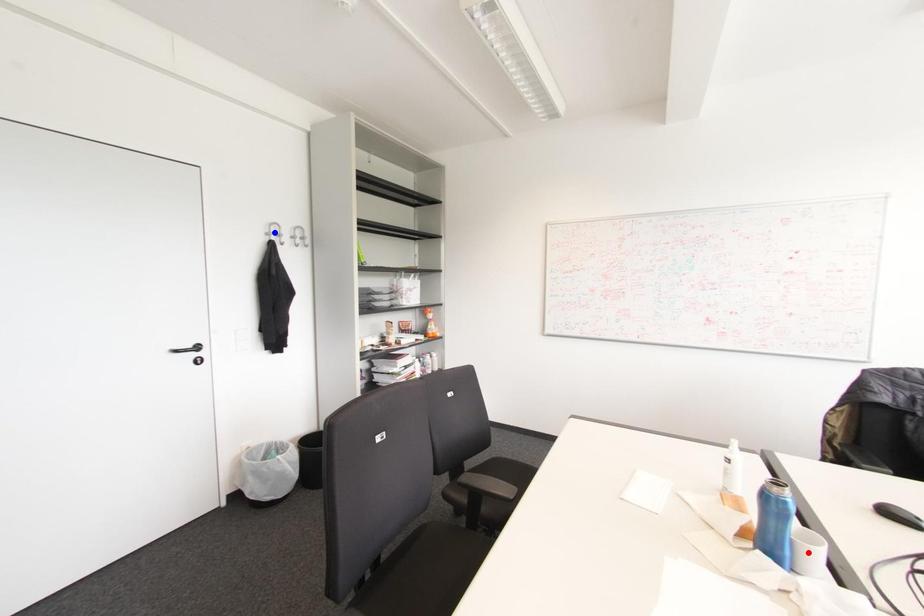
Question: Which of the two points in the image is closer to the camera?

Choices:
 (A) Blue point is closer.
 (B) Red point is closer.

Answer: (B)